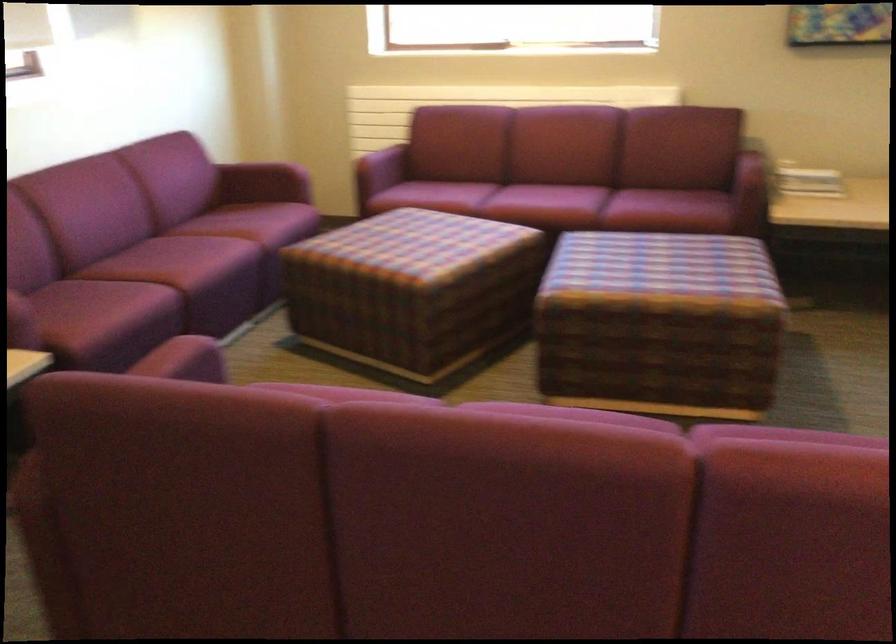
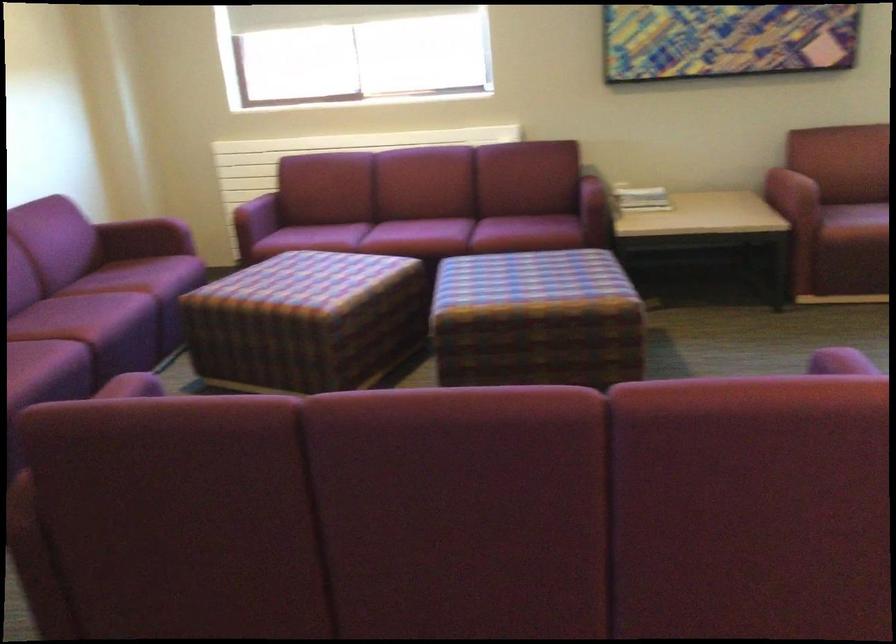
In the second image, find the point that corresponds to [573,207] in the first image.

(445, 236)